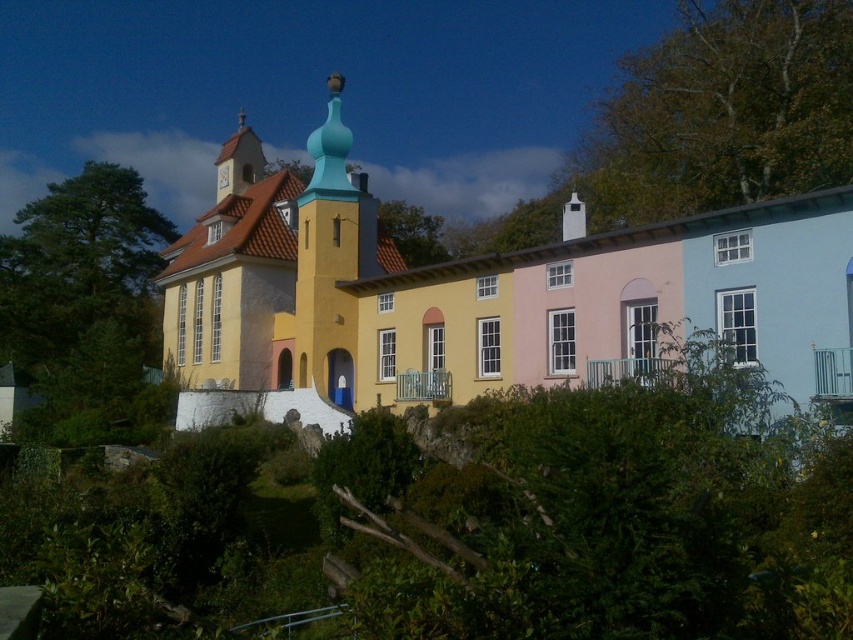
Is point (492, 342) closer to viewer compared to point (393, 243)?

Yes, it is.

The height and width of the screenshot is (640, 853). In order to click on yellow matte building at center in this screenshot , I will do `click(480, 298)`.

This screenshot has width=853, height=640. In order to click on yellow matte building at center in this screenshot , I will do `click(480, 298)`.

Where is `yellow matte building at center`? The height and width of the screenshot is (640, 853). yellow matte building at center is located at coordinates (480, 298).

Does green leafy tree at upper right have a greater width compared to green leafy tree at left?

In fact, green leafy tree at upper right might be narrower than green leafy tree at left.

Does green leafy tree at upper right appear on the left side of green leafy tree at left?

In fact, green leafy tree at upper right is to the right of green leafy tree at left.

Where is `green leafy tree at upper right`? The image size is (853, 640). green leafy tree at upper right is located at coordinates pos(724,112).

The width and height of the screenshot is (853, 640). I want to click on green leafy tree at upper right, so click(724, 112).

Does yellow matte building at center appear on the right side of green leafy tree at left?

Indeed, yellow matte building at center is positioned on the right side of green leafy tree at left.

Who is shorter, yellow matte building at center or green leafy tree at left?

yellow matte building at center is shorter.

Between point (486, 333) and point (131, 269), which one is positioned in front?

Point (486, 333) is more forward.

Identify the location of yellow matte building at center. (480, 298).